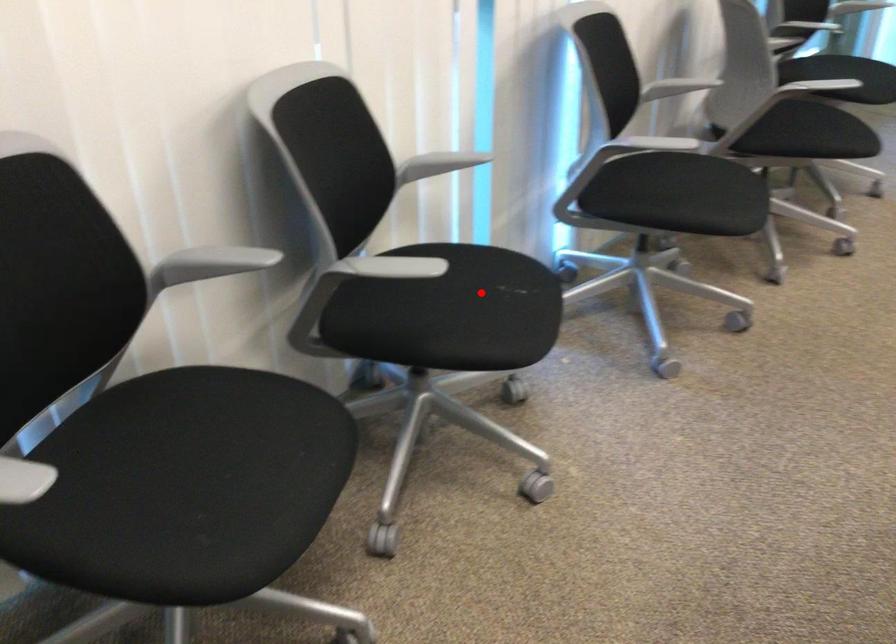
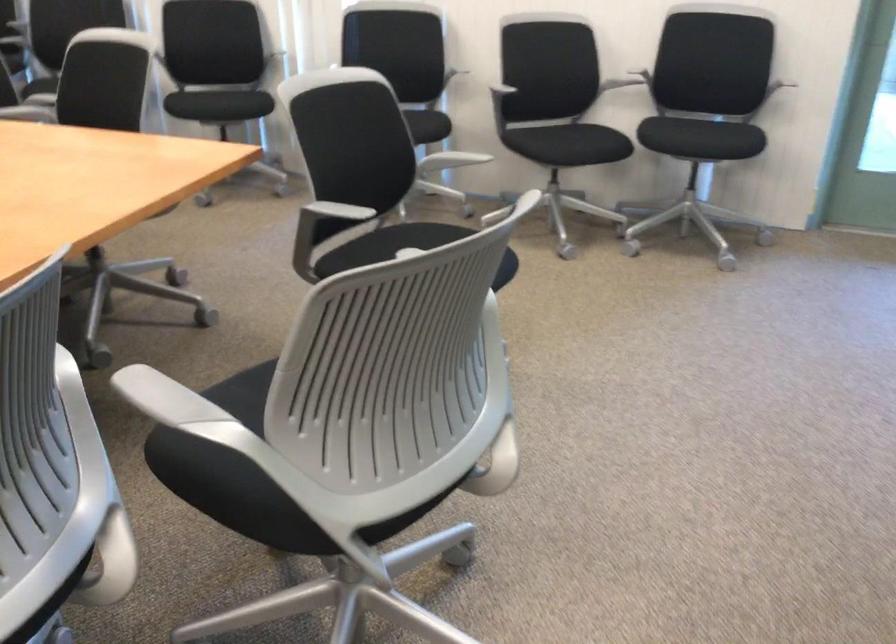
Locate, in the second image, the point that corresponds to the highlighted location in the first image.

(238, 102)